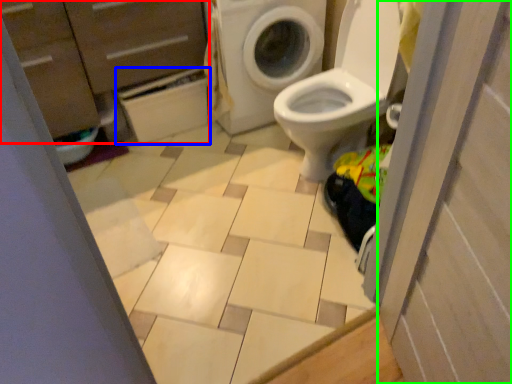
Question: Which object is positioned closest to dresser (highlighted by a red box)? Select from cabinetry (highlighted by a blue box) and screen door (highlighted by a green box).

Choices:
 (A) cabinetry
 (B) screen door

Answer: (A)